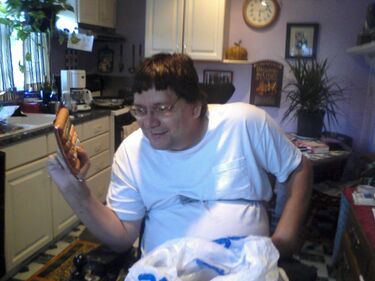
Identify the location of green plant. The height and width of the screenshot is (281, 375). (311, 94).